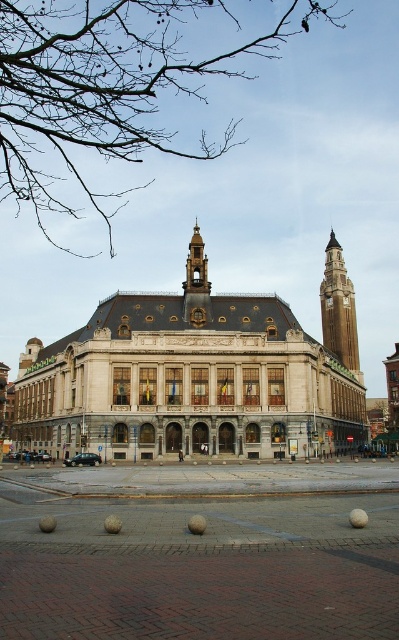
Question: Among these points, which one is nearest to the camera?

Choices:
 (A) (308, 582)
 (B) (167, 397)
 (C) (327, 253)

Answer: (A)

Question: Does beige stone building at center appear under brown stone clock tower at upper right?

Choices:
 (A) no
 (B) yes

Answer: (B)

Question: Which point is farther to the camera?

Choices:
 (A) (221, 557)
 (B) (312, 429)

Answer: (B)

Question: Can you confirm if beige stone building at center is positioned below brown stone clock tower at upper right?

Choices:
 (A) yes
 (B) no

Answer: (A)

Question: Is brick paving at center wider than beige stone building at center?

Choices:
 (A) no
 (B) yes

Answer: (A)

Question: Among these points, which one is nearest to the camera?

Choices:
 (A) (341, 250)
 (B) (136, 636)

Answer: (B)